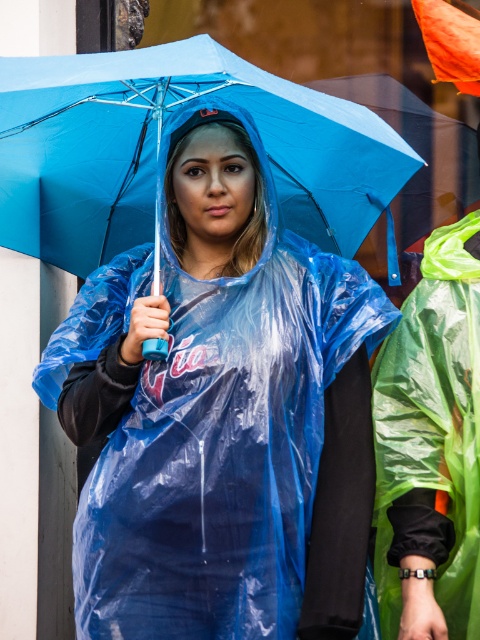
Question: Which object is farther from the camera taking this photo?

Choices:
 (A) transparent plastic raincoat at center
 (B) transparent plastic umbrella at center

Answer: (A)

Question: Among these objects, which one is nearest to the camera?

Choices:
 (A) transparent plastic umbrella at center
 (B) blue matte umbrella at center
 (C) transparent plastic raincoat at center

Answer: (A)

Question: Can you confirm if transparent plastic umbrella at center is positioned below blue matte umbrella at center?

Choices:
 (A) yes
 (B) no

Answer: (A)

Question: Is transparent plastic raincoat at center further to camera compared to transparent plastic umbrella at center?

Choices:
 (A) yes
 (B) no

Answer: (A)

Question: Which point is closer to the camera taking this photo?

Choices:
 (A) (399, 113)
 (B) (196, 584)

Answer: (B)

Question: Can you confirm if transparent plastic raincoat at center is thinner than blue matte umbrella at center?

Choices:
 (A) yes
 (B) no

Answer: (B)